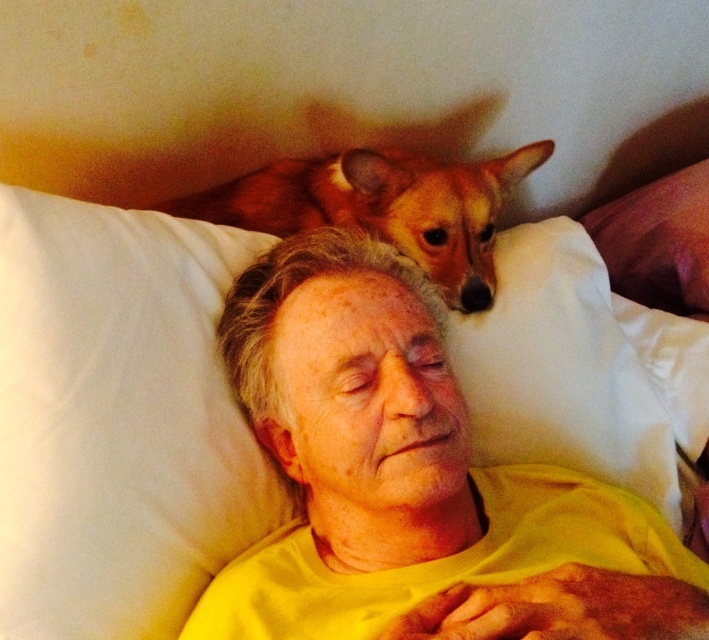
You are a photographer trying to capture a closeup of the brown fur dog at upper center without including the white soft pillow at upper center in the frame. Based on their positions, is this possible?

The white soft pillow at upper center is located below the brown fur dog at upper center, so it is possible to capture a closeup of the brown fur dog at upper center without including the pillow by focusing on the upper part of the dog where the pillow isn not present.

You are a photographer trying to capture a closeup of the yellow matte shirt at center and the white soft pillow at upper left. Which object is closer to the camera?

The white soft pillow at upper left is closer to the camera than the yellow matte shirt at center because the yellow matte shirt at center is positioned under the white soft pillow at upper left.